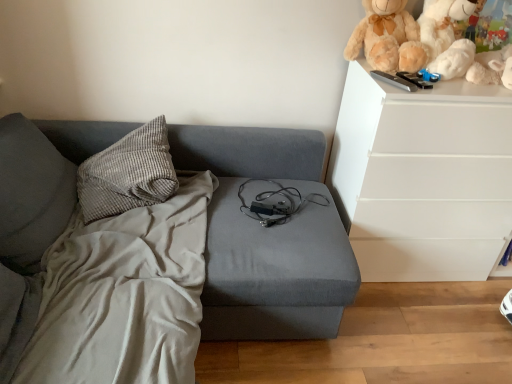
Question: Does white plush teddy bear at upper right have a lesser width compared to white plush toy at upper right?

Choices:
 (A) no
 (B) yes

Answer: (B)

Question: Is white plush teddy bear at upper right in contact with white plush toy at upper right?

Choices:
 (A) yes
 (B) no

Answer: (A)

Question: Does white plush teddy bear at upper right have a lesser height compared to white plush toy at upper right?

Choices:
 (A) no
 (B) yes

Answer: (B)

Question: From a real-world perspective, does white plush teddy bear at upper right sit lower than white plush toy at upper right?

Choices:
 (A) yes
 (B) no

Answer: (B)

Question: Considering the relative positions of white plush teddy bear at upper right and white plush toy at upper right in the image provided, is white plush teddy bear at upper right to the left of white plush toy at upper right from the viewer's perspective?

Choices:
 (A) yes
 (B) no

Answer: (B)

Question: Considering the positions of gray corduroy pillow at upper left and fluffy beige teddy bear at upper right in the image, is gray corduroy pillow at upper left bigger or smaller than fluffy beige teddy bear at upper right?

Choices:
 (A) small
 (B) big

Answer: (B)

Question: In terms of width, does gray corduroy pillow at upper left look wider or thinner when compared to fluffy beige teddy bear at upper right?

Choices:
 (A) wide
 (B) thin

Answer: (A)

Question: Considering the positions of gray corduroy pillow at upper left and fluffy beige teddy bear at upper right in the image, is gray corduroy pillow at upper left taller or shorter than fluffy beige teddy bear at upper right?

Choices:
 (A) tall
 (B) short

Answer: (B)

Question: Is gray corduroy pillow at upper left to the left or to the right of fluffy beige teddy bear at upper right in the image?

Choices:
 (A) right
 (B) left

Answer: (B)

Question: Is point (430, 36) positioned closer to the camera than point (446, 11)?

Choices:
 (A) farther
 (B) closer

Answer: (B)

Question: Looking at their shapes, would you say white plush toy at upper right is wider or thinner than white plush teddy bear at upper right?

Choices:
 (A) thin
 (B) wide

Answer: (B)

Question: Relative to white plush teddy bear at upper right, is white plush toy at upper right in front or behind?

Choices:
 (A) behind
 (B) front

Answer: (B)

Question: Considering the positions of white plush toy at upper right and white plush teddy bear at upper right in the image, is white plush toy at upper right bigger or smaller than white plush teddy bear at upper right?

Choices:
 (A) big
 (B) small

Answer: (A)

Question: In the image, is white plush teddy bear at upper right positioned in front of or behind gray corduroy pillow at upper left?

Choices:
 (A) front
 (B) behind

Answer: (B)

Question: Is white plush teddy bear at upper right to the left or to the right of gray corduroy pillow at upper left in the image?

Choices:
 (A) right
 (B) left

Answer: (A)